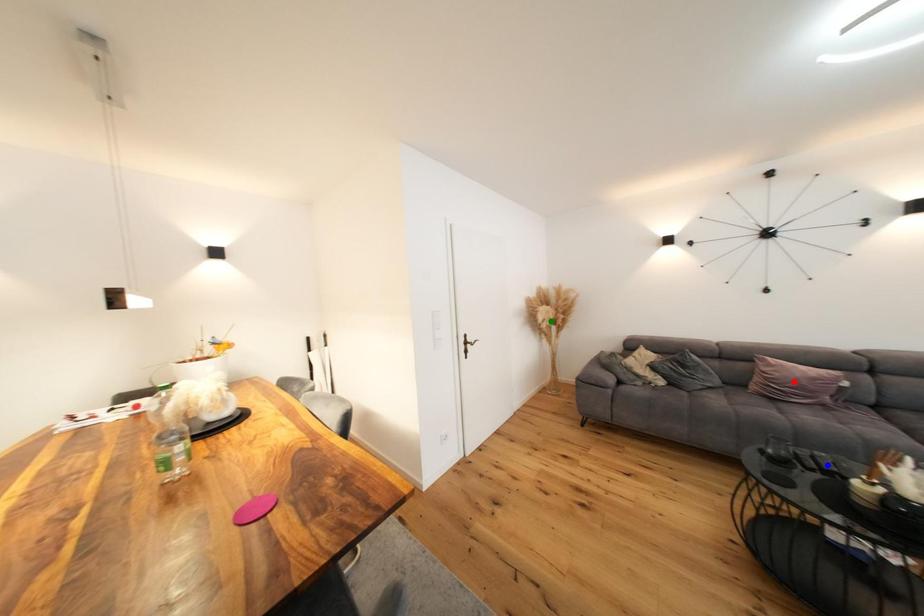
Order these from nearest to farthest:
- blue point
- red point
- green point

blue point
red point
green point